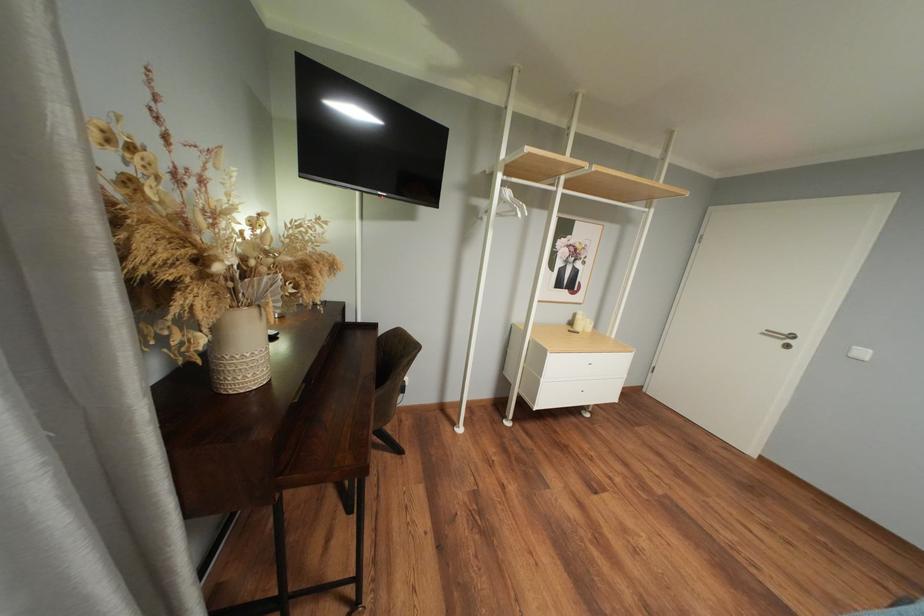
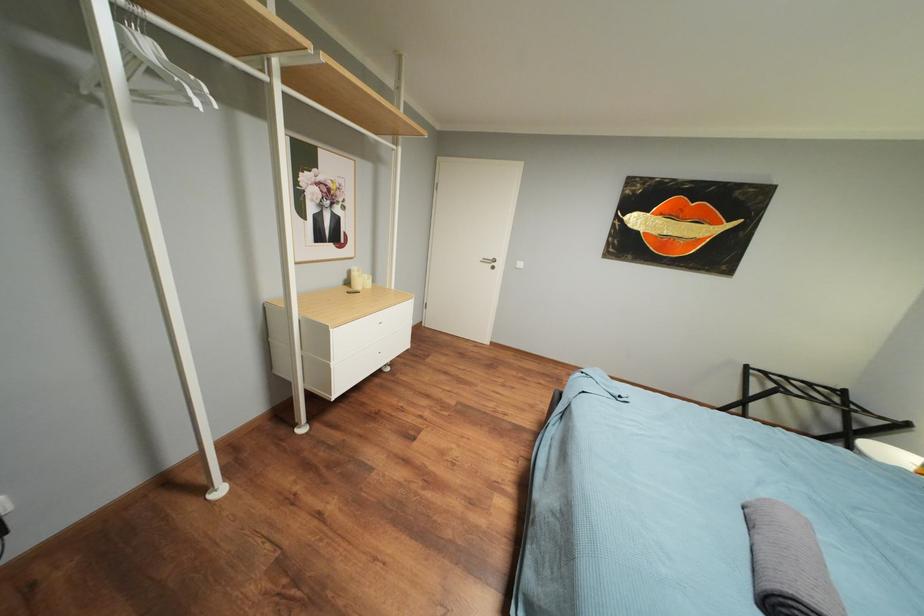
Question: How did the camera likely rotate?

Choices:
 (A) Left
 (B) Right
 (C) Up
 (D) Down

Answer: (B)